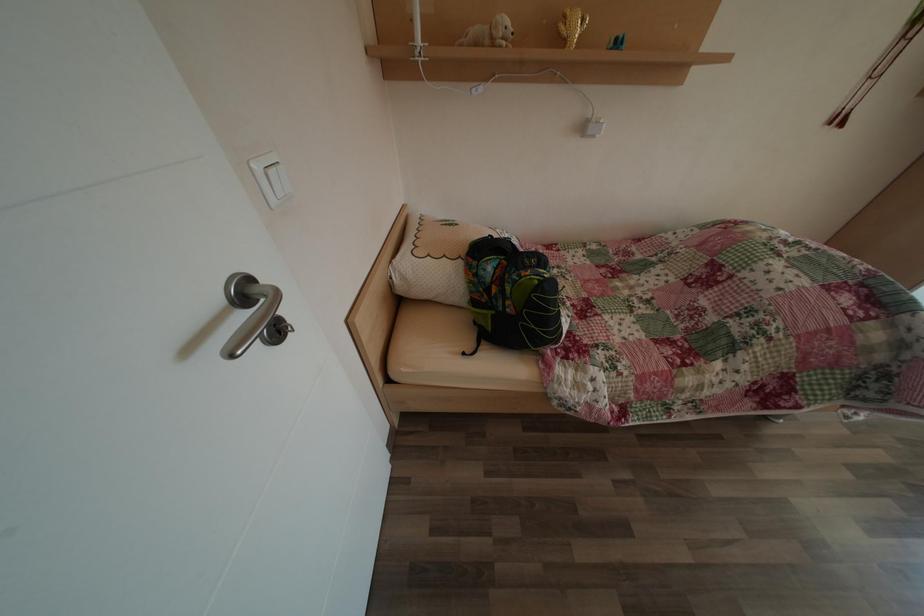
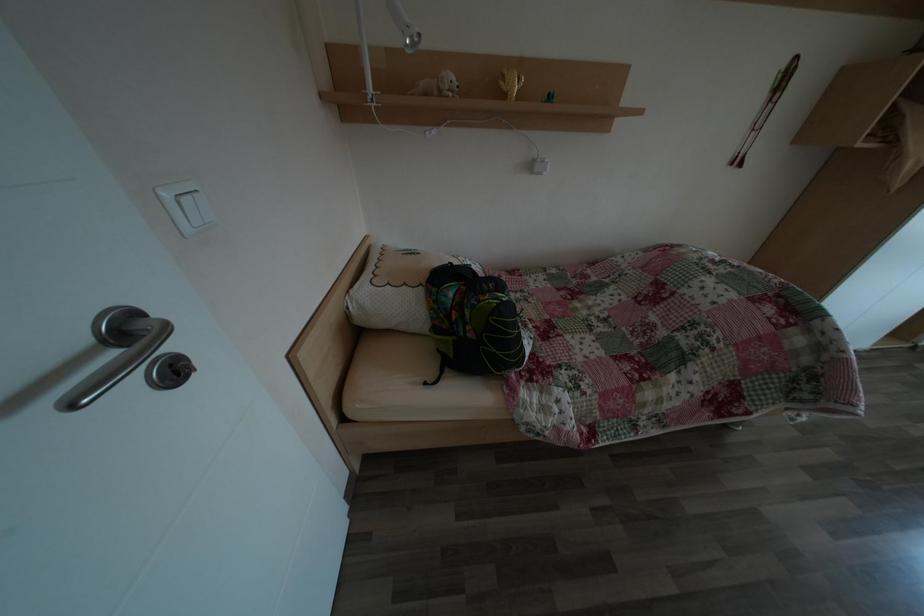
Question: The first image is from the beginning of the video and the second image is from the end. How did the camera likely rotate when shooting the video?

Choices:
 (A) Left
 (B) Right
 (C) Up
 (D) Down

Answer: (C)